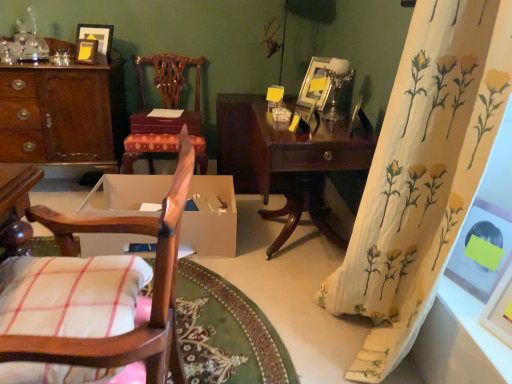
Locate an element on the screen. Image resolution: width=512 pixels, height=384 pixels. free space to the left of matte white picture frame at right, the first picture frame when ordered from right to left is located at coordinates (480, 335).